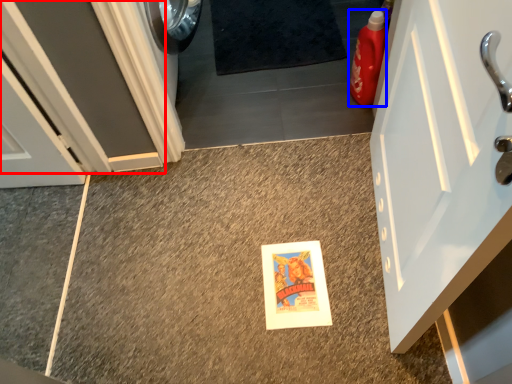
Question: Which point is closer to the camera, door (highlighted by a red box) or cleaning product (highlighted by a blue box)?

Choices:
 (A) door
 (B) cleaning product

Answer: (A)